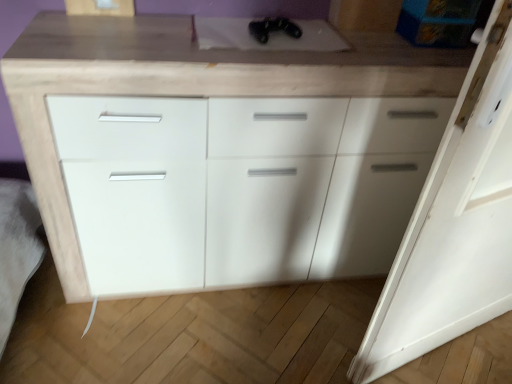
The image size is (512, 384). In order to click on vacant space situated above black matte controller at upper center (from a real-world perspective) in this screenshot , I will do `click(269, 36)`.